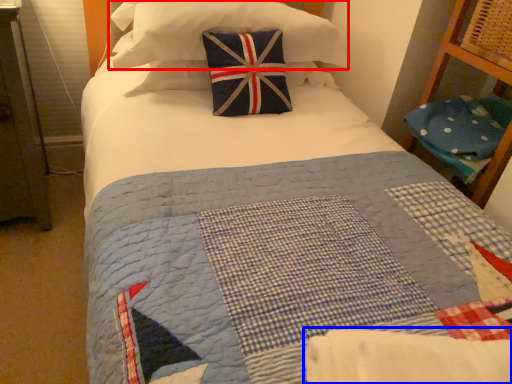
Question: Among these objects, which one is nearest to the camera, pillow (highlighted by a red box) or blanket (highlighted by a blue box)?

Choices:
 (A) pillow
 (B) blanket

Answer: (B)